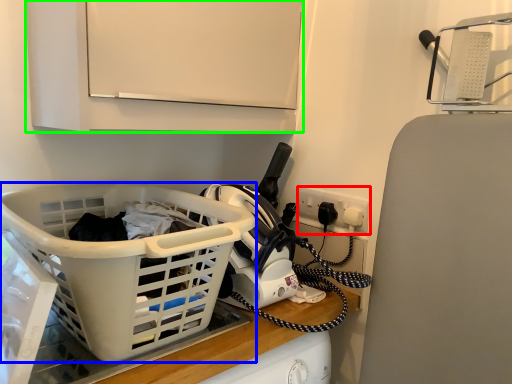
Question: Estimate the real-world distances between objects in this image. Which object is closer to electric outlet (highlighted by a red box), basket (highlighted by a blue box) or cabinetry (highlighted by a green box)?

Choices:
 (A) basket
 (B) cabinetry

Answer: (B)